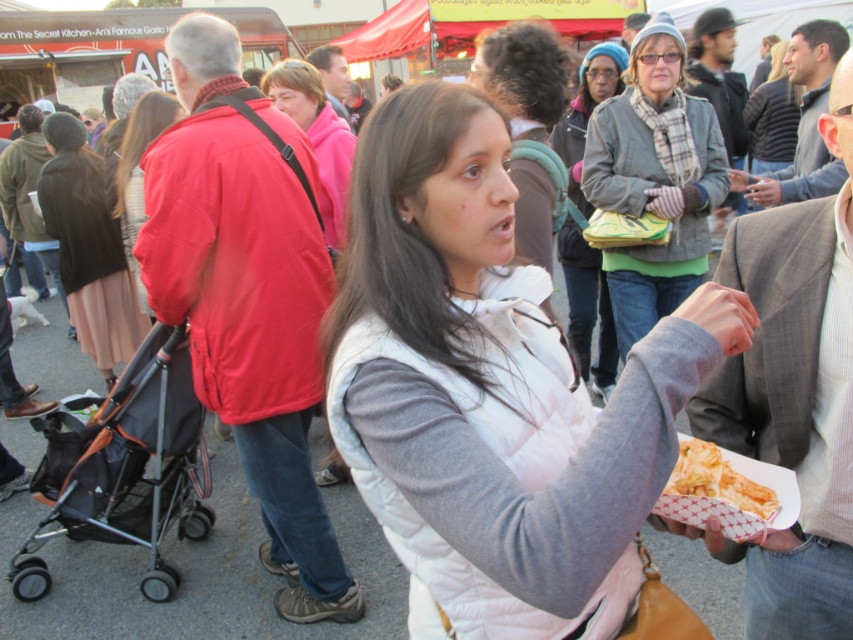
You are standing at the entrance of the market and see the white quilted vest at center and the red jacket at left. Which person is closer to you?

The white quilted vest at center is closer to you because it is in front of the red jacket at left.

You are standing at the entrance of the market and see the white quilted vest at center and the red jacket at left. Which clothing item is closer to the front of the scene?

The white quilted vest at center is closer to the front of the scene because it is located below the red jacket at left, indicating it is positioned in front.

Based on the scene description, can you determine the spatial relationship between the gray striped shirt at center and the red matte jacket at upper left?

The gray striped shirt at center is positioned to the right of the red matte jacket at upper left.